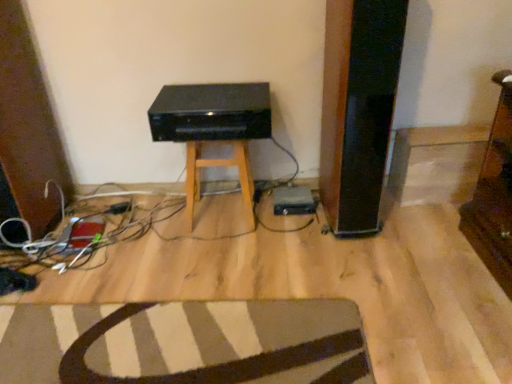
Find the location of a particular element. free space between black plastic plug at lower left and striped fabric rug at lower center is located at coordinates (161, 267).